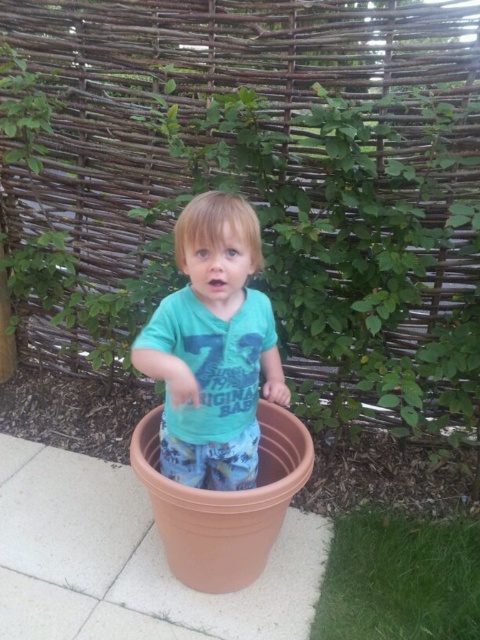
Question: Where is green grass at lower right located in relation to green leafy plant at upper left in the image?

Choices:
 (A) below
 (B) above

Answer: (A)

Question: Does green matte shirt at center appear under green grass at lower right?

Choices:
 (A) no
 (B) yes

Answer: (A)

Question: Does green matte shirt at center appear over green leafy plant at upper left?

Choices:
 (A) no
 (B) yes

Answer: (A)

Question: Which point is closer to the camera?

Choices:
 (A) green grass at lower right
 (B) green matte shirt at center

Answer: (B)

Question: Among these objects, which one is nearest to the camera?

Choices:
 (A) green leafy plant at upper left
 (B) green grass at lower right
 (C) green matte shirt at center
 (D) matte terracotta pot at center

Answer: (C)

Question: Which point is farther from the camera taking this photo?

Choices:
 (A) (217, 208)
 (B) (0, 67)

Answer: (B)